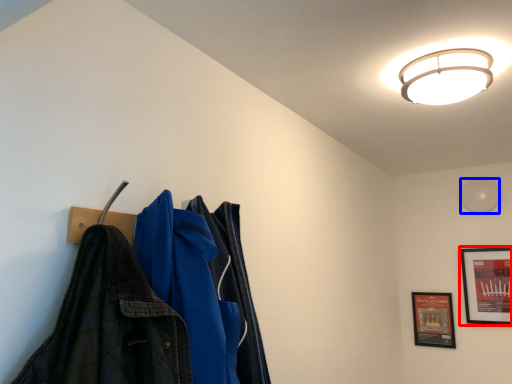
Question: Which of the following is the farthest to the observer, picture frame (highlighted by a red box) or light (highlighted by a blue box)?

Choices:
 (A) picture frame
 (B) light

Answer: (B)